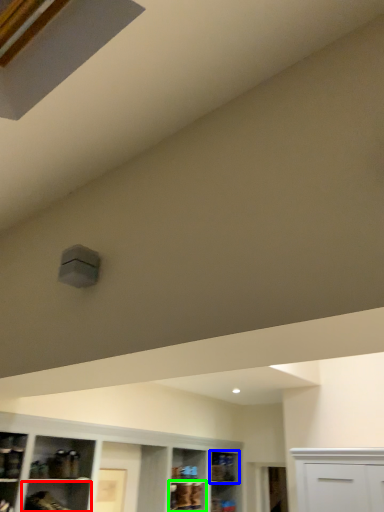
Question: Based on their relative distances, which object is nearer to shelf (highlighted by a red box)? Choose from shelf (highlighted by a blue box) and cabinet (highlighted by a green box).

Choices:
 (A) shelf
 (B) cabinet

Answer: (B)